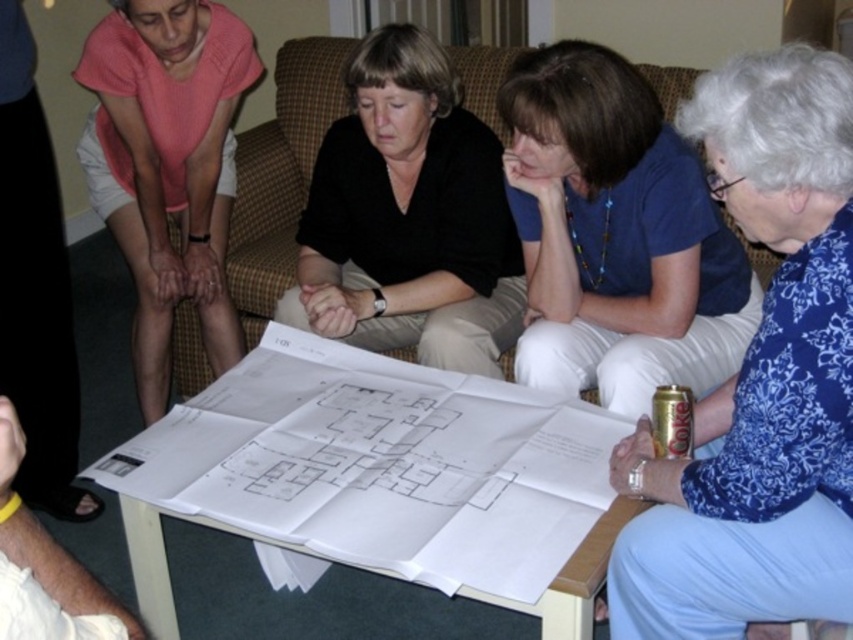
You are an interior designer who needs to determine clothing sizes for a photoshoot. If the blue floral blouse at lower right is narrower than the pink cotton shirt at upper left, which one would you choose for a model requiring a more fitted look?

The blue floral blouse at lower right has a narrower width than the pink cotton shirt at upper left, so it would be the better choice for a model needing a more fitted look.

You are a new intern joining the meeting and need to sit between the blue fabric shirt at center and the black matte shirt at center. Which side should you choose to ensure you are seated between them?

The blue fabric shirt at center has a smaller size compared to black matte shirt at center, so you should sit between them by choosing the side closer to the blue fabric shirt at center since it is smaller and likely positioned closer to the center of the table, allowing space for the larger black matte shirt at center on the other side.